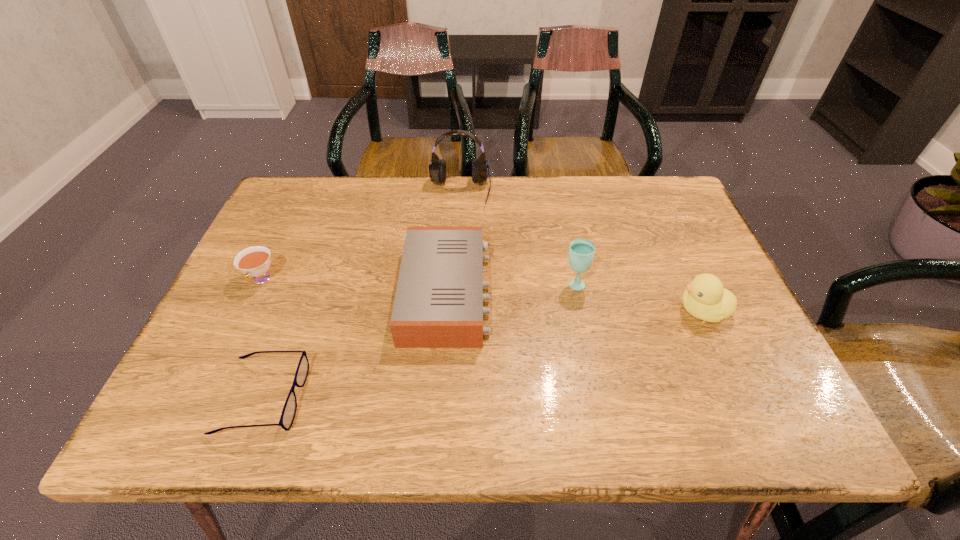
Where is `free space located on the front of the fifth object from left to right`? This screenshot has height=540, width=960. free space located on the front of the fifth object from left to right is located at coordinates (604, 427).

Where is `free spot located at the beak of the rightmost object`? free spot located at the beak of the rightmost object is located at coordinates (618, 311).

Where is `vacant space located 0.290m at the beak of the rightmost object`? The width and height of the screenshot is (960, 540). vacant space located 0.290m at the beak of the rightmost object is located at coordinates (546, 311).

Where is `free space located 0.160m at the beak of the rightmost object`? This screenshot has width=960, height=540. free space located 0.160m at the beak of the rightmost object is located at coordinates tap(605, 311).

The width and height of the screenshot is (960, 540). Identify the location of vacant area located on the control panel of the radio receiver. pyautogui.click(x=533, y=293).

The height and width of the screenshot is (540, 960). Identify the location of vacant space located on the side of the teacup with the handle. (190, 430).

You are a GUI agent. You are given a task and a screenshot of the screen. Output one action in this format:
    pyautogui.click(x=<x>, y=<y>)
    Task: Click on the blank space located on the front-facing side of the nearest object
    This screenshot has height=540, width=960.
    Given the screenshot: What is the action you would take?
    pyautogui.click(x=480, y=397)

This screenshot has width=960, height=540. Identify the location of object present at the far edge. (437, 169).

At what (x,y) coordinates should I click in order to perform the action: click on object present at the near edge. Please return your answer as a coordinate pair (x, y). This screenshot has width=960, height=540. Looking at the image, I should click on (288, 414).

Identify the location of teacup situated at the left edge. The width and height of the screenshot is (960, 540). (254, 261).